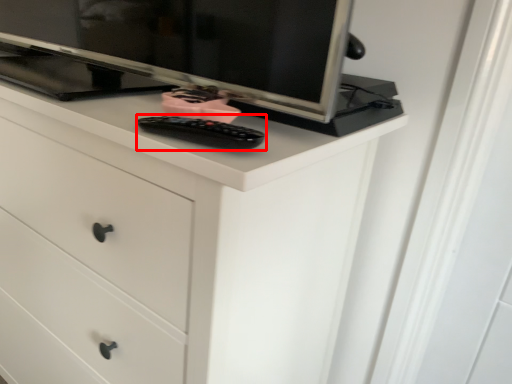
Question: From the image's perspective, what is the correct spatial relationship of control (annotated by the red box) in relation to chest of drawers?

Choices:
 (A) below
 (B) above

Answer: (B)